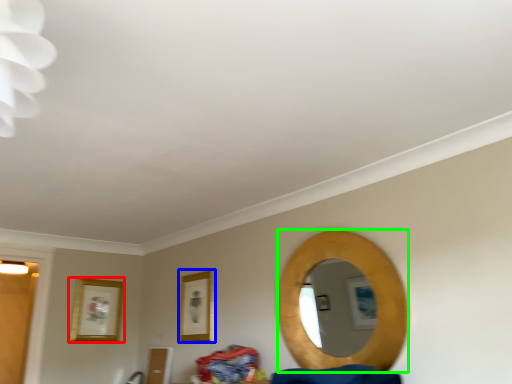
Question: Which is nearer to the picture frame (highlighted by a red box)? picture frame (highlighted by a blue box) or mirror (highlighted by a green box).

Choices:
 (A) picture frame
 (B) mirror

Answer: (A)